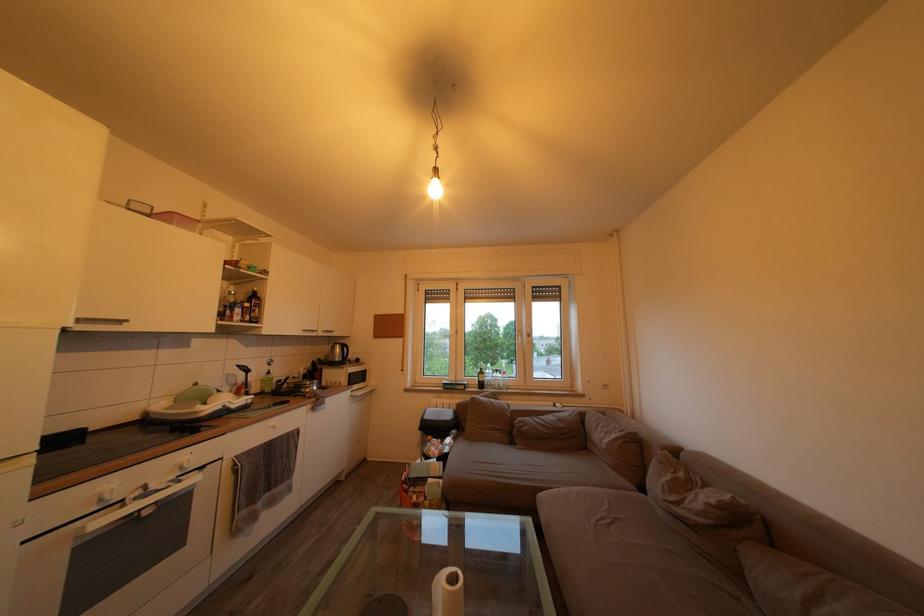
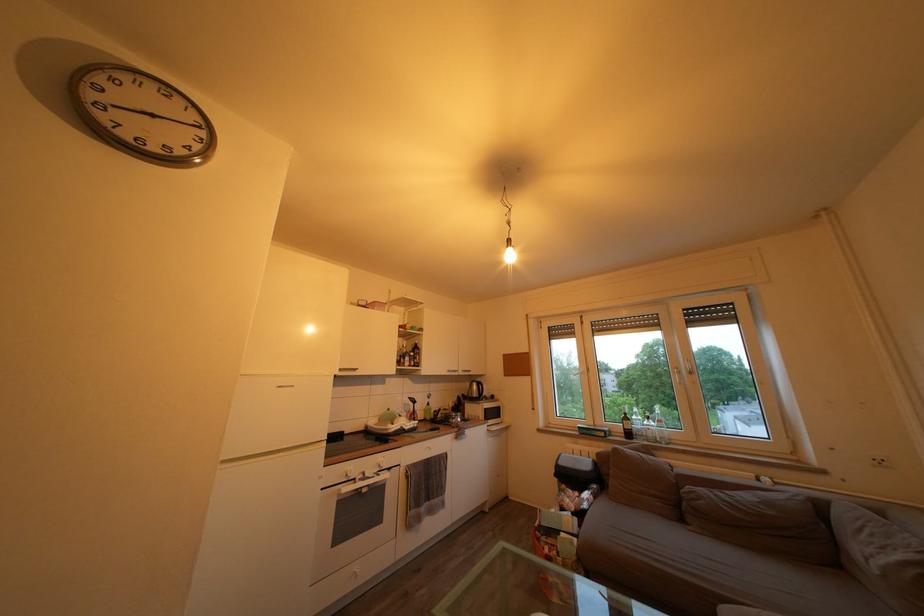
Find the pixel in the second image that matches (276,379) in the first image.

(436, 411)